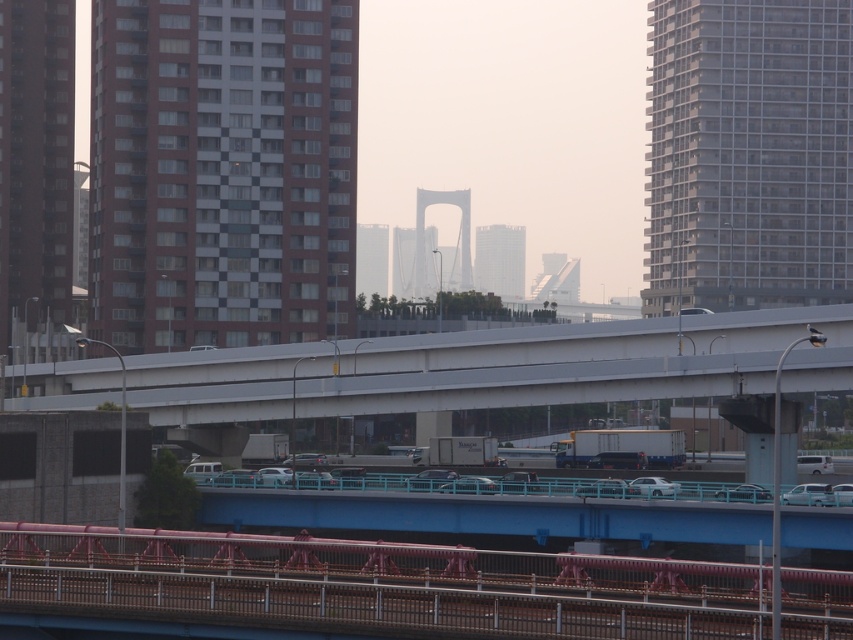
Is gray glass building at upper right positioned in front of metallic silver sedan at lower right?

No, it is not.

Is point (653, 156) closer to camera compared to point (798, 484)?

No.

What do you see at coordinates (747, 154) in the screenshot? This screenshot has width=853, height=640. I see `gray glass building at upper right` at bounding box center [747, 154].

Where is `gray glass building at upper right`? The image size is (853, 640). gray glass building at upper right is located at coordinates (747, 154).

Identify the location of brick textured building at left. This screenshot has height=640, width=853. (221, 172).

Is point (283, 220) behind point (468, 248)?

No, it is not.

What do you see at coordinates (221, 172) in the screenshot? I see `brick textured building at left` at bounding box center [221, 172].

You are a GUI agent. You are given a task and a screenshot of the screen. Output one action in this format:
    pyautogui.click(x=<x>, y=<y>)
    Task: Click on the brick textured building at left
    The image size is (853, 640).
    Given the screenshot: What is the action you would take?
    pyautogui.click(x=221, y=172)

Is point (821, 500) less distant than point (660, 477)?

Yes, point (821, 500) is in front of point (660, 477).

Locate an element on the screen. The image size is (853, 640). metallic silver sedan at lower right is located at coordinates (808, 493).

Image resolution: width=853 pixels, height=640 pixels. I want to click on metallic silver sedan at lower right, so click(x=808, y=493).